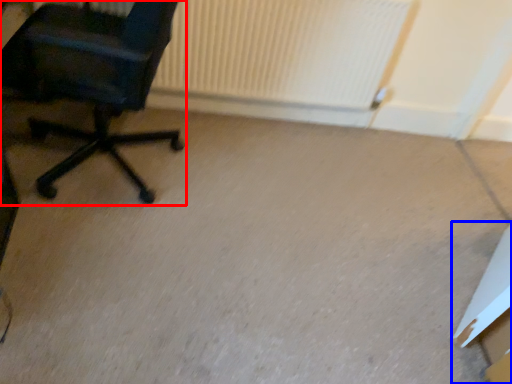
Question: Which of the following is the farthest to the observer, chair (highlighted by a red box) or cardboard box (highlighted by a blue box)?

Choices:
 (A) chair
 (B) cardboard box

Answer: (B)